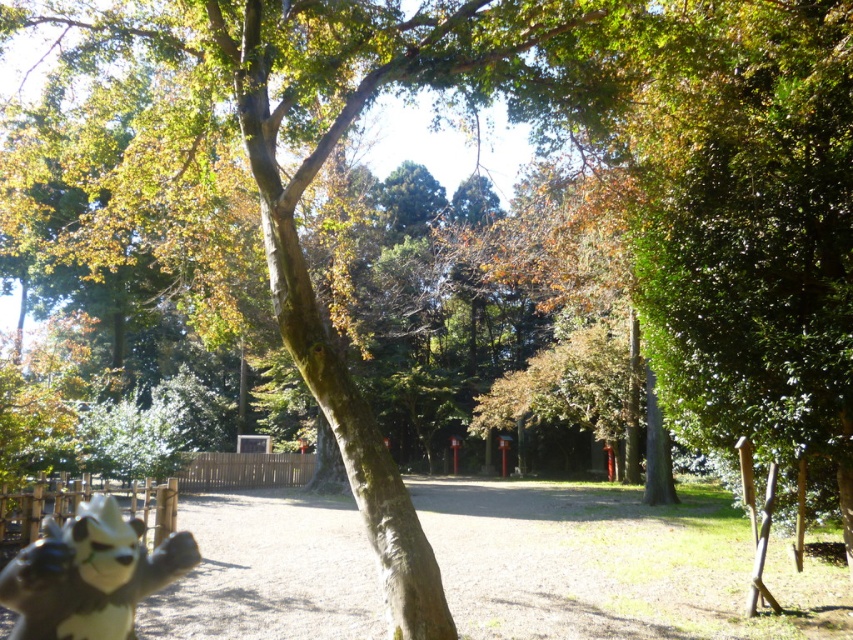
You are planning to place a new bench in the park scene shown. The bench requires a space wider than the black and white fur statue at lower left. Can the dirt ground at center accommodate the bench?

The dirt ground at center has a width larger than the black and white fur statue at lower left, so it can accommodate the bench.

Consider the image. You are a photographer setting up a tripod in the park. You want to place your tripod on the dirt ground at center without blocking the view of the black and white fur statue at lower left. Is this possible?

The black and white fur statue at lower left is behind the dirt ground at center, so placing the tripod on the dirt ground at center won wait block the view of the statue since it is positioned behind the ground.